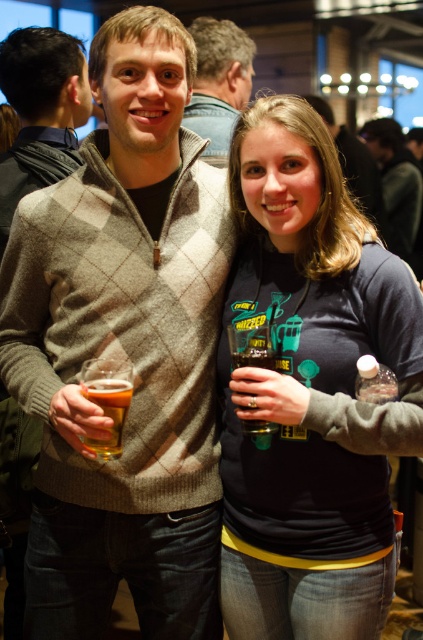
Is light brown sweater at center taller than green matte glass at center?

Yes, light brown sweater at center is taller than green matte glass at center.

Between point (356, 166) and point (274, 426), which one is positioned in front?

Point (274, 426) is in front.

Is point (353, 168) behind point (269, 358)?

Yes, point (353, 168) is farther from viewer.

The image size is (423, 640). I want to click on light brown sweater at center, so click(x=354, y=163).

Is dark gray sweatshirt at center thinner than knit sweater at left?

Incorrect, dark gray sweatshirt at center's width is not less than knit sweater at left's.

From the picture: Is dark gray sweatshirt at center positioned in front of knit sweater at left?

Yes, it is in front of knit sweater at left.

The image size is (423, 640). Describe the element at coordinates (310, 390) in the screenshot. I see `dark gray sweatshirt at center` at that location.

Identify the location of dark gray sweatshirt at center. (310, 390).

Is knit sweater at center smaller than green matte glass at center?

No.

Between knit sweater at center and green matte glass at center, which one is positioned higher?

Positioned higher is knit sweater at center.

Measure the distance between point (195, 252) and camera.

Point (195, 252) is 4.50 feet away from camera.

Locate an element on the screen. The height and width of the screenshot is (640, 423). knit sweater at center is located at coordinates (123, 349).